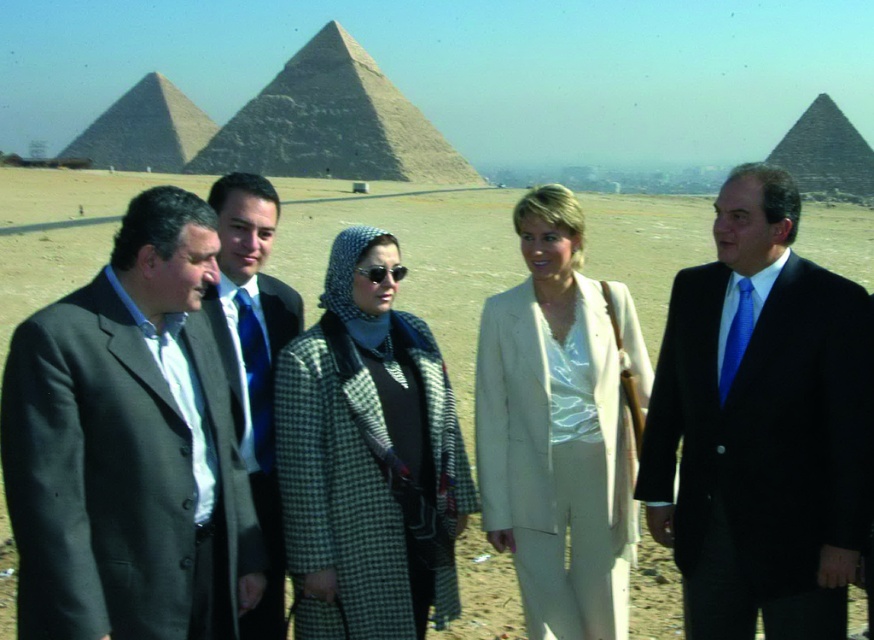
Question: Does smooth beige pyramid at center have a larger size compared to smooth stone pyramid at upper left?

Choices:
 (A) yes
 (B) no

Answer: (B)

Question: Is desert at center wider than blue silk tie at center?

Choices:
 (A) no
 (B) yes

Answer: (B)

Question: Which of the following is the closest to the observer?

Choices:
 (A) desert at center
 (B) beige fabric suit at center

Answer: (B)

Question: Which of the following is the farthest from the observer?

Choices:
 (A) (60, 312)
 (B) (302, 620)
 (C) (191, 148)

Answer: (C)

Question: Is dark gray suit at left smaller than smooth stone pyramid at upper left?

Choices:
 (A) yes
 (B) no

Answer: (A)

Question: Which point is closer to the camera?

Choices:
 (A) (496, 586)
 (B) (378, 518)
 (C) (445, 170)

Answer: (B)